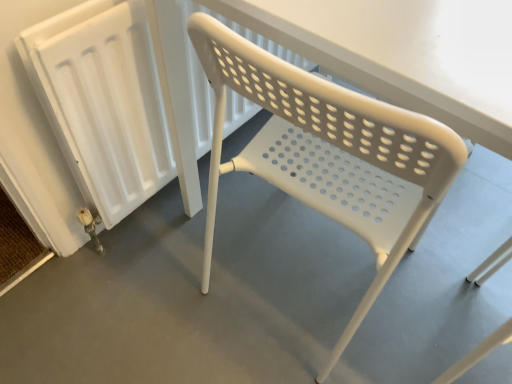
Question: Can you confirm if white plastic chair at center is shorter than white plastic chair at center?

Choices:
 (A) no
 (B) yes

Answer: (A)

Question: Does white plastic chair at center turn towards white plastic chair at center?

Choices:
 (A) no
 (B) yes

Answer: (A)

Question: Is white plastic chair at center thinner than white plastic chair at center?

Choices:
 (A) yes
 (B) no

Answer: (A)

Question: Are white plastic chair at center and white plastic chair at center located far from each other?

Choices:
 (A) yes
 (B) no

Answer: (B)

Question: Is white plastic chair at center wider than white plastic chair at center?

Choices:
 (A) yes
 (B) no

Answer: (B)

Question: From a real-world perspective, is white plastic chair at center physically below white plastic chair at center?

Choices:
 (A) no
 (B) yes

Answer: (A)

Question: Is there a large distance between white plastic radiator at left and white plastic chair at center?

Choices:
 (A) yes
 (B) no

Answer: (B)

Question: From the image's perspective, is white plastic radiator at left located above white plastic chair at center?

Choices:
 (A) yes
 (B) no

Answer: (A)

Question: Considering the relative sizes of white plastic radiator at left and white plastic chair at center in the image provided, is white plastic radiator at left smaller than white plastic chair at center?

Choices:
 (A) no
 (B) yes

Answer: (B)

Question: Is white plastic chair at center located within white plastic radiator at left?

Choices:
 (A) no
 (B) yes

Answer: (A)

Question: From the image's perspective, is white plastic radiator at left below white plastic chair at center?

Choices:
 (A) no
 (B) yes

Answer: (A)

Question: Considering the relative sizes of white plastic radiator at left and white plastic chair at center in the image provided, is white plastic radiator at left wider than white plastic chair at center?

Choices:
 (A) no
 (B) yes

Answer: (A)

Question: Can you confirm if white plastic chair at center is positioned to the right of white plastic chair at center?

Choices:
 (A) yes
 (B) no

Answer: (A)